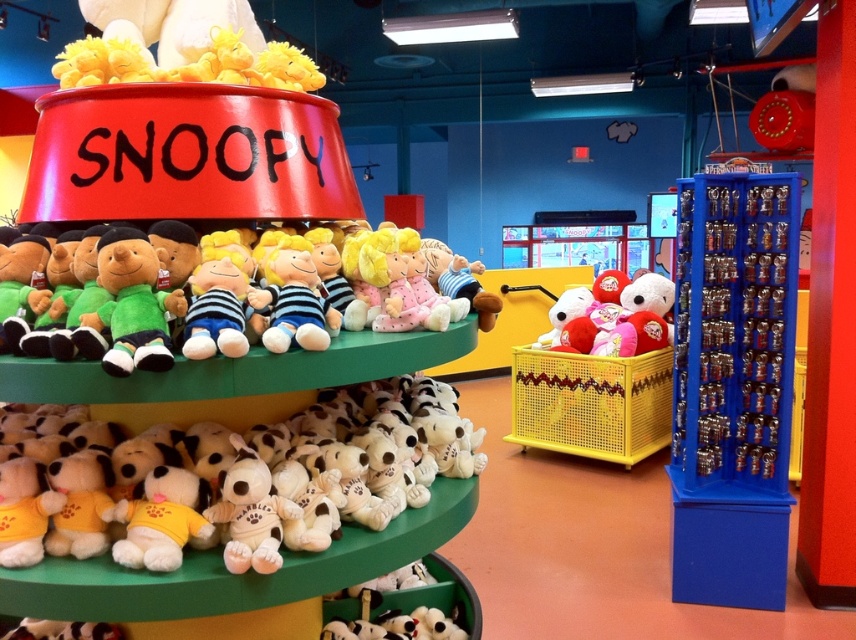
Can you confirm if blue plastic keychain rack at right is taller than striped fabric plush at center?

Indeed, blue plastic keychain rack at right has a greater height compared to striped fabric plush at center.

Between blue plastic keychain rack at right and striped fabric plush at center, which one is positioned lower?

blue plastic keychain rack at right

This screenshot has width=856, height=640. Identify the location of blue plastic keychain rack at right. (733, 387).

Identify the location of blue plastic keychain rack at right. The width and height of the screenshot is (856, 640). (733, 387).

Who is more forward, (x=93, y=236) or (x=296, y=323)?

Point (x=296, y=323) is more forward.

Identify the location of soft plush toys at center. This screenshot has width=856, height=640. point(224,250).

Does blue plastic keychain rack at right have a lesser height compared to soft plush toys at center?

Incorrect, blue plastic keychain rack at right's height does not fall short of soft plush toys at center's.

Is blue plastic keychain rack at right to the left of soft plush toys at center from the viewer's perspective?

No, blue plastic keychain rack at right is not to the left of soft plush toys at center.

Is point (727, 193) closer to camera compared to point (262, 236)?

No, it is behind (262, 236).

The height and width of the screenshot is (640, 856). In order to click on blue plastic keychain rack at right in this screenshot , I will do `click(733, 387)`.